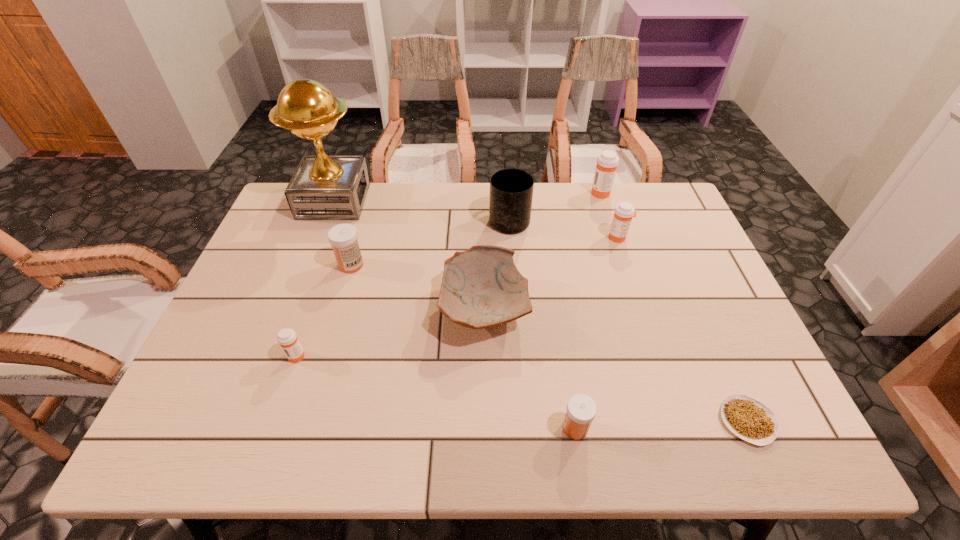
Locate an element on the screen. blank area located on the left of the second nearest orange medicine is located at coordinates (568, 238).

The height and width of the screenshot is (540, 960). In order to click on vacant position located 0.110m on the right of the left white medicine in this screenshot , I will do `click(403, 265)`.

I want to click on blank area located 0.380m on the back of the pottery, so click(x=483, y=192).

The width and height of the screenshot is (960, 540). I want to click on free spot located 0.050m on the right of the smallest orange medicine, so click(326, 355).

Locate an element on the screen. The width and height of the screenshot is (960, 540). free region located 0.310m on the back of the nearest medicine is located at coordinates (556, 303).

At what (x,y) coordinates should I click in order to perform the action: click on vacant space located on the back of the legume. Please return your answer as a coordinate pair (x, y). The image size is (960, 540). Looking at the image, I should click on (684, 280).

Locate an element on the screen. This screenshot has width=960, height=540. award present at the far edge is located at coordinates (324, 187).

The width and height of the screenshot is (960, 540). In order to click on mug that is at the far edge in this screenshot , I will do `click(511, 190)`.

Locate an element on the screen. Image resolution: width=960 pixels, height=540 pixels. medicine that is at the far edge is located at coordinates (607, 162).

Where is `medicine that is at the near edge`? The image size is (960, 540). medicine that is at the near edge is located at coordinates (581, 409).